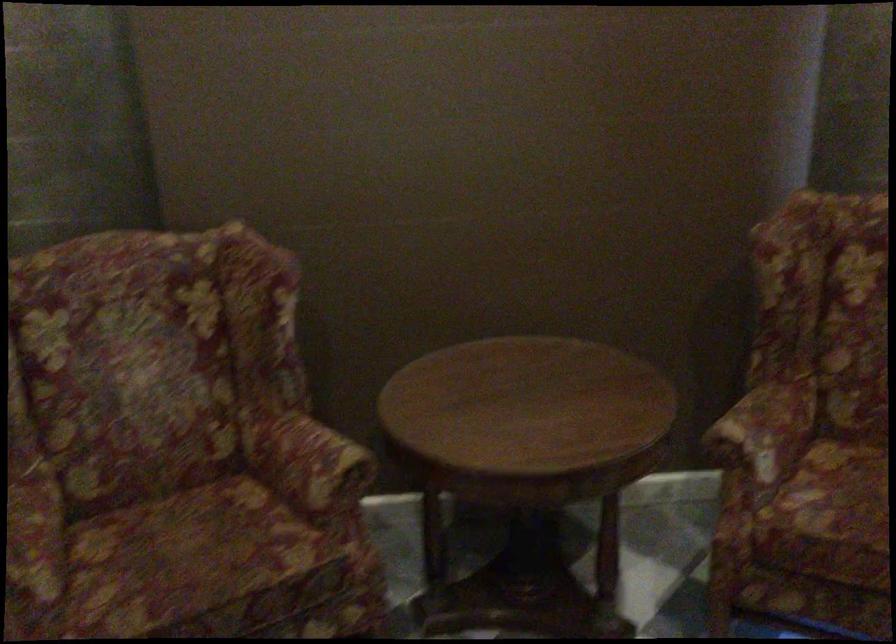
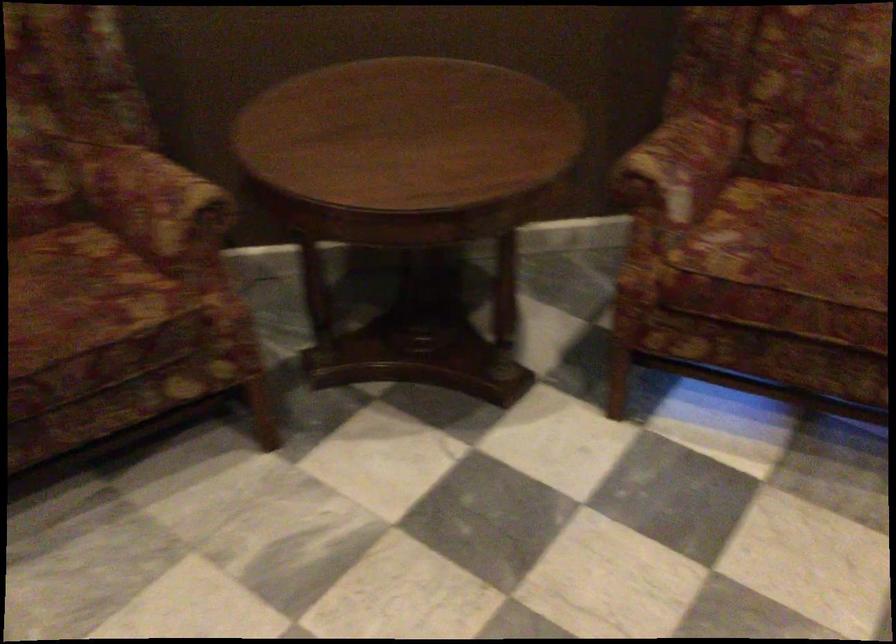
Where in the second image is the point corresponding to point (308, 460) from the first image?

(156, 204)